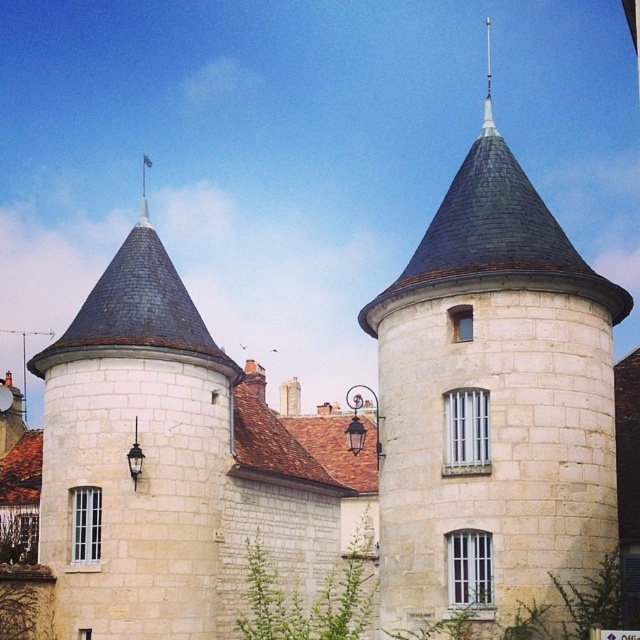
Question: Does white stone tower at center appear on the left side of smooth stone tower at left?

Choices:
 (A) no
 (B) yes

Answer: (A)

Question: Does white stone tower at center lie in front of smooth stone tower at left?

Choices:
 (A) yes
 (B) no

Answer: (A)

Question: Among these objects, which one is nearest to the camera?

Choices:
 (A) smooth stone tower at left
 (B) white stone tower at center

Answer: (B)

Question: Which of the following is the farthest from the observer?

Choices:
 (A) (579, 515)
 (B) (177, 541)

Answer: (B)

Question: From the image, what is the correct spatial relationship of white stone tower at center in relation to smooth stone tower at left?

Choices:
 (A) right
 (B) left

Answer: (A)